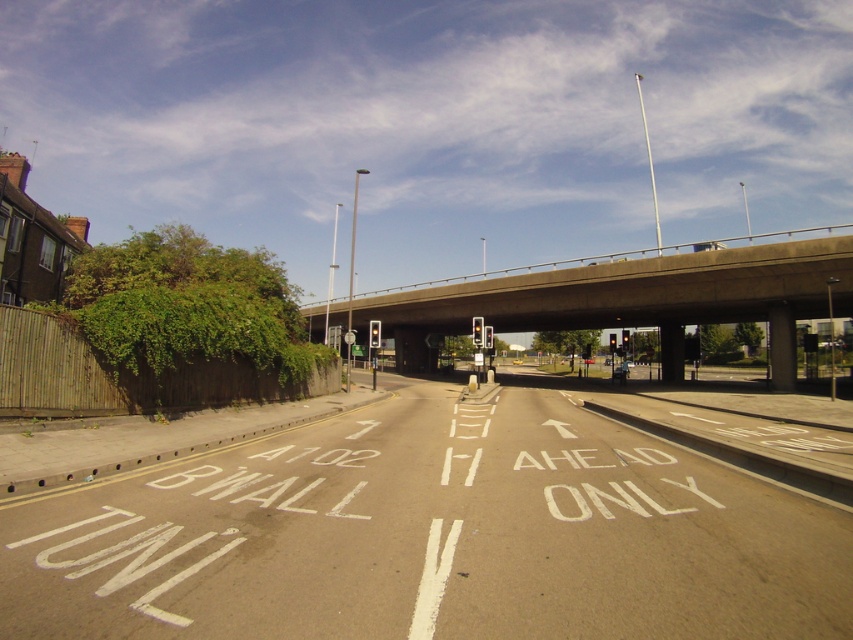
Does white asphalt road at center have a greater height compared to concrete bridge at center?

Incorrect, white asphalt road at center's height is not larger of concrete bridge at center's.

Is point (227, 600) farther from viewer compared to point (624, 289)?

No.

Who is more distant from viewer, [351,440] or [587,301]?

Positioned behind is point [587,301].

What are the coordinates of `white asphalt road at center` in the screenshot? It's located at (428, 536).